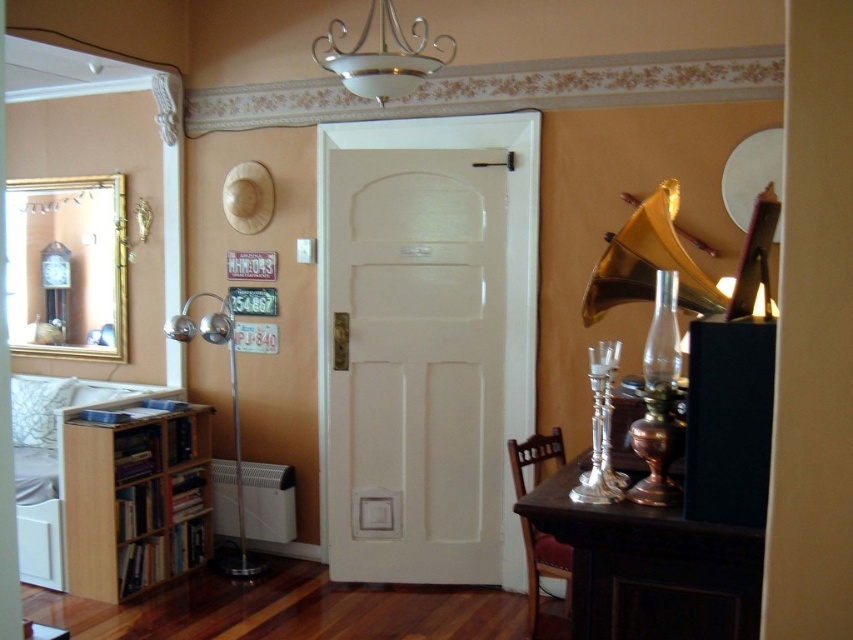
Based on the photo, you are arranging flowers in the image. You have a vase that needs to be placed on a surface. Which object can you place the vase on, the dark wood table at right or the satin silver floor lamp at left?

The dark wood table at right is located above the satin silver floor lamp at left, so the vase can be placed on the dark wood table at right.

You are standing in the room and want to place a new plant on the dark wood table at right. To reach the table, you have to walk past the satin silver floor lamp at left. Based on their positions, will you have enough space to move around the lamp and reach the table?

The dark wood table at right is in front of the satin silver floor lamp at left, meaning the table is closer to you than the lamp. Therefore, you can easily move around the lamp and reach the table since the table is positioned in front of the lamp.